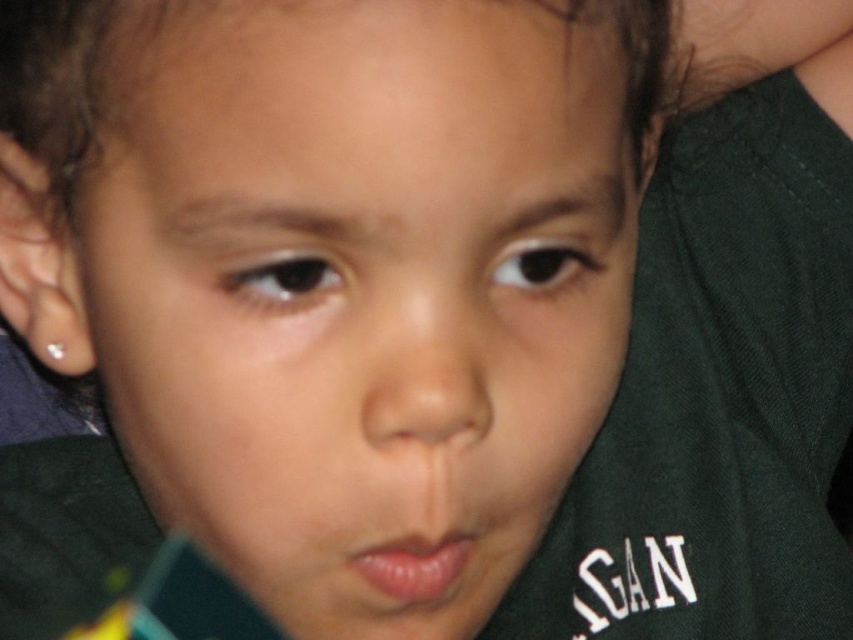
Where is the smooth skin face at center located in the image?

The smooth skin face at center is located at point (358, 285).

You are an artist trying to draw the child from the image. When sketching the face, which feature should you place in front of the other between the smooth skin nose at center and the pink smooth lips at center?

The smooth skin nose at center is closer to the viewer than the pink smooth lips at center, so you should draw the smooth skin nose at center in front of the pink smooth lips at center.

You are a photographer trying to capture a close portrait of a child. The child is currently positioned such that their smooth skin face at center is 8.43 inches from the camera. If you want to ensure the face fills the frame more, should you move the camera closer or farther away from the child?

Since the smooth skin face at center is currently 8.43 inches from the camera, moving the camera closer to the child would make the face appear larger in the frame, thus filling it more.